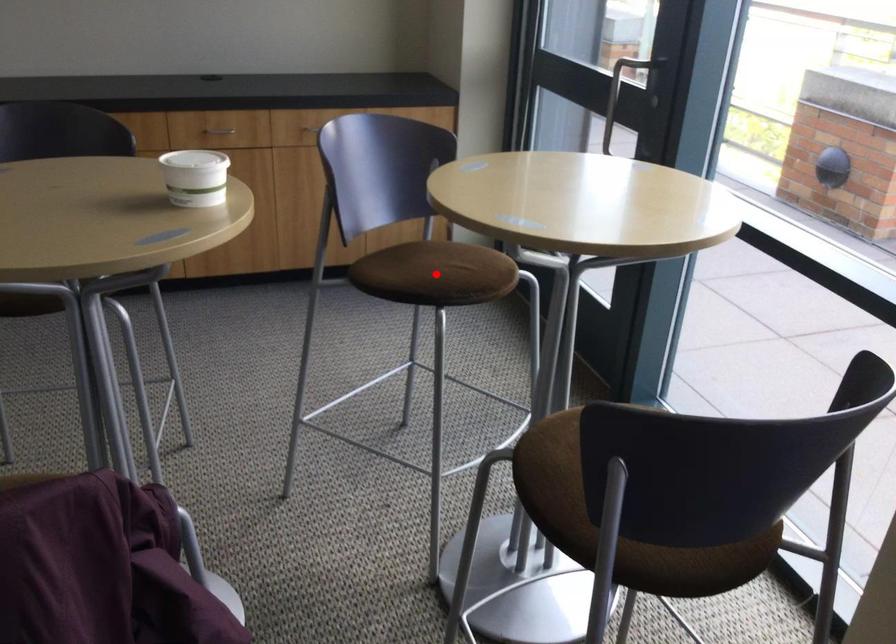
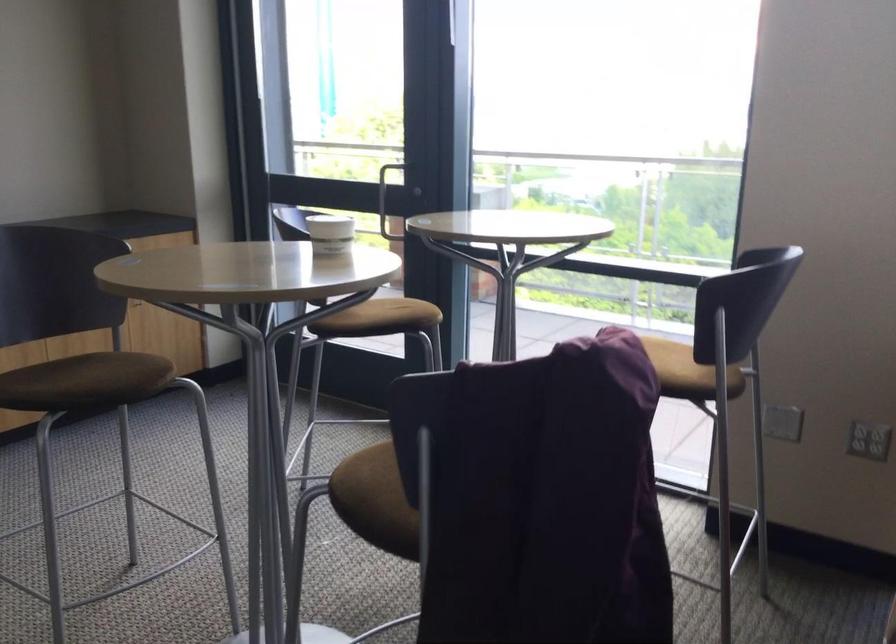
Question: I am providing you with two images of the same scene from different viewpoints. A red point is shown in image1. For the corresponding object point in image2, is it positioned nearer or farther from the camera?

Choices:
 (A) Nearer
 (B) Farther

Answer: (B)